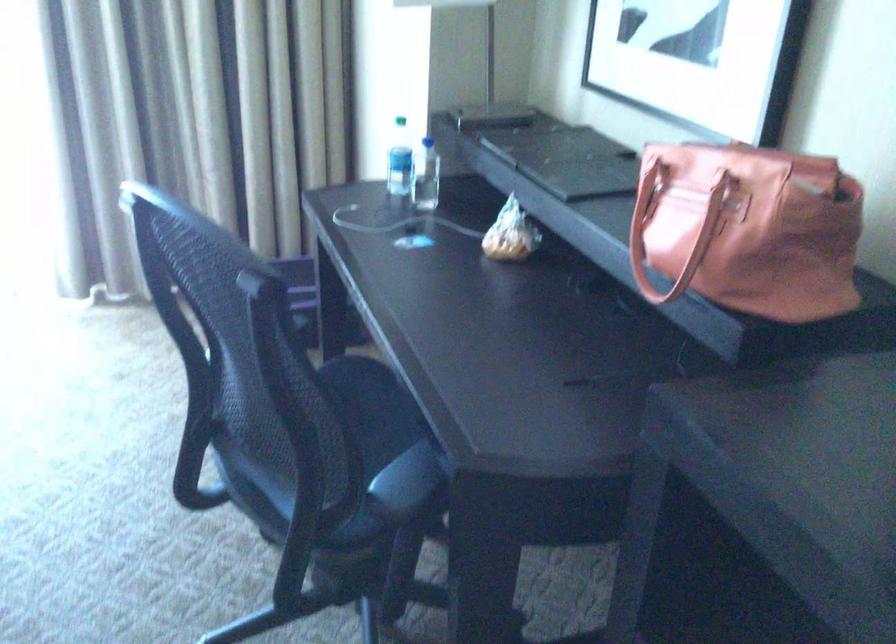
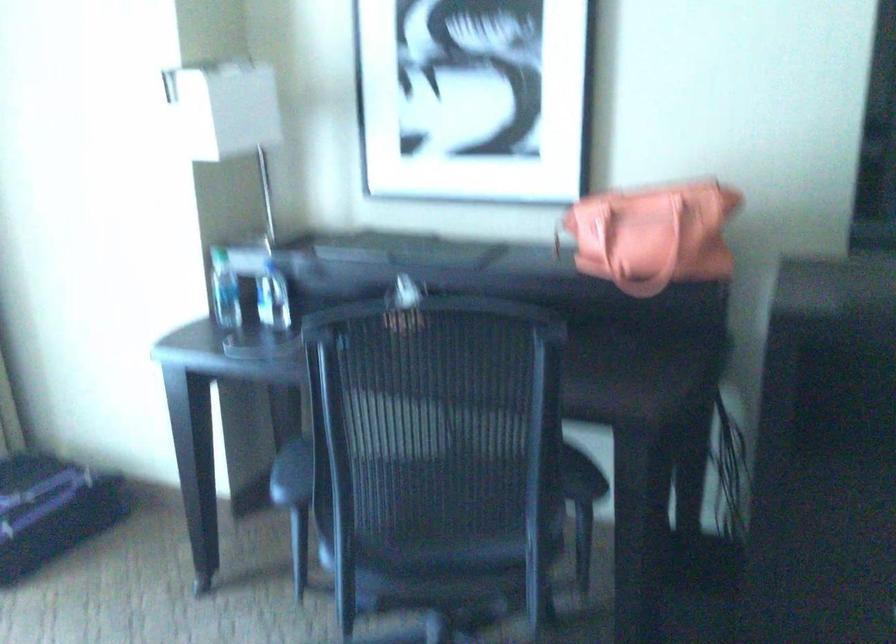
In the second image, find the point that corresponds to [285,480] in the first image.

(458, 544)